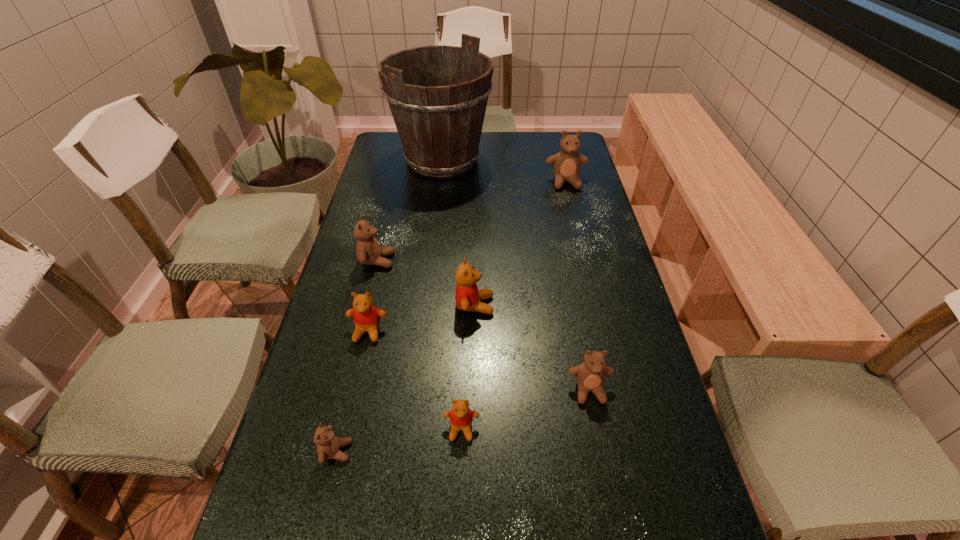
Where is `free spot between the nearest red teddy bear and the second tallest object`? The image size is (960, 540). free spot between the nearest red teddy bear and the second tallest object is located at coordinates (514, 305).

Identify the location of free space between the smallest red teddy bear and the tallest teddy bear. This screenshot has height=540, width=960. (514, 305).

The width and height of the screenshot is (960, 540). In order to click on object that is the seventh closest to the tallest object in this screenshot , I will do `click(328, 445)`.

Identify which object is the nearest to the third farthest object. Please provide its 2D coordinates. Your answer should be formatted as a tuple, i.e. [(x, y)], where the tuple contains the x and y coordinates of a point satisfying the conditions above.

[(366, 316)]

The height and width of the screenshot is (540, 960). I want to click on the second closest teddy bear to the smallest brown teddy bear, so click(366, 316).

You are a GUI agent. You are given a task and a screenshot of the screen. Output one action in this format:
    pyautogui.click(x=<x>, y=<y>)
    Task: Click on the teddy bear that is the third closest one to the farthest teddy bear
    The width and height of the screenshot is (960, 540).
    Given the screenshot: What is the action you would take?
    pyautogui.click(x=366, y=316)

This screenshot has width=960, height=540. I want to click on brown teddy bear that is the third closest one to the sixth farthest object, so click(566, 164).

Identify the location of brown teddy bear that is the closest to the sixth farthest object. This screenshot has height=540, width=960. (328, 445).

Identify which red teddy bear is the second closest to the second smallest red teddy bear. Please provide its 2D coordinates. Your answer should be formatted as a tuple, i.e. [(x, y)], where the tuple contains the x and y coordinates of a point satisfying the conditions above.

[(461, 417)]

The width and height of the screenshot is (960, 540). What are the coordinates of `the closest red teddy bear to the fifth farthest teddy bear` in the screenshot? It's located at (461, 417).